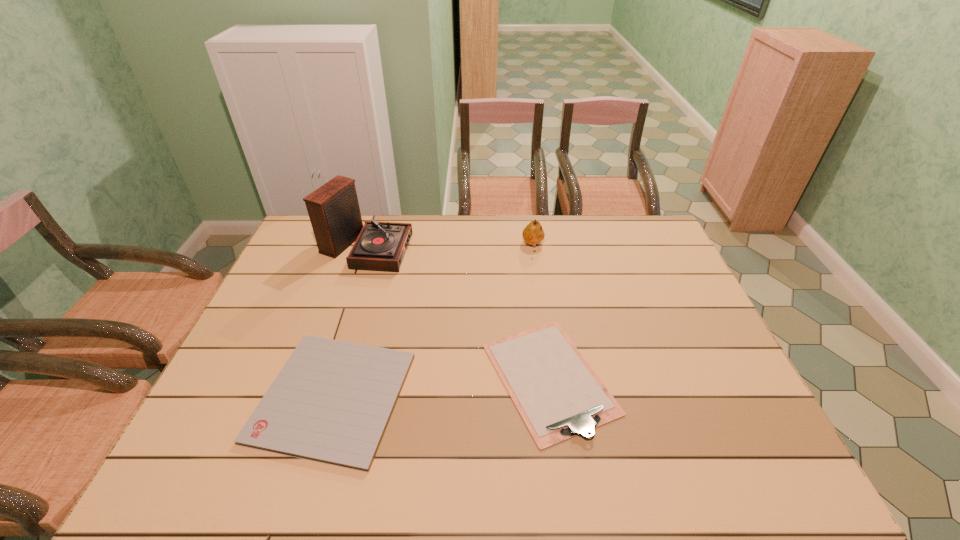
Identify the location of the tallest object. (334, 212).

You are a GUI agent. You are given a task and a screenshot of the screen. Output one action in this format:
    pyautogui.click(x=<x>, y=<y>)
    Task: Click on the third shortest object
    The width and height of the screenshot is (960, 540).
    Given the screenshot: What is the action you would take?
    pyautogui.click(x=533, y=233)

This screenshot has height=540, width=960. What are the coordinates of `the taller clipboard` in the screenshot? It's located at (559, 396).

The image size is (960, 540). What are the coordinates of `the third tallest object` in the screenshot? It's located at (559, 396).

The height and width of the screenshot is (540, 960). I want to click on the left clipboard, so pyautogui.click(x=331, y=402).

Identify the location of the shorter clipboard. The image size is (960, 540). (331, 402).

At what (x,y) coordinates should I click in order to perform the action: click on vacant region located 0.230m on the front of the phonograph record. Please return your answer as a coordinate pair (x, y). The width and height of the screenshot is (960, 540). Looking at the image, I should click on (342, 323).

Identify the location of vacant position located on the right of the pear. (603, 246).

Identify the location of free space located on the back of the taller clipboard. (537, 293).

Image resolution: width=960 pixels, height=540 pixels. Identify the location of vacant space positioned 0.210m on the back of the left clipboard. (365, 289).